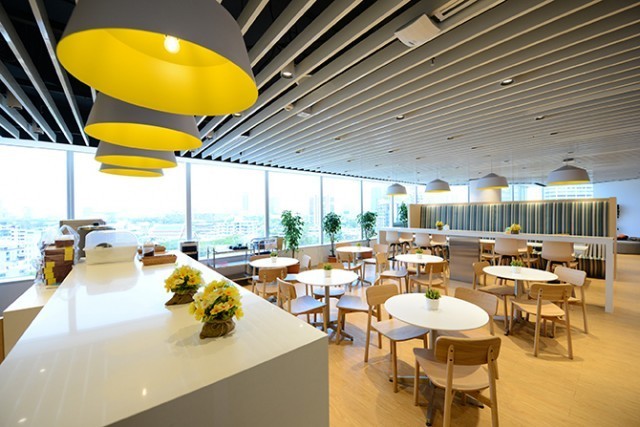
Where is `windows`? The height and width of the screenshot is (427, 640). windows is located at coordinates (27, 191), (143, 205), (228, 204), (300, 196), (336, 192), (381, 198), (445, 194), (504, 194), (525, 194), (560, 194).